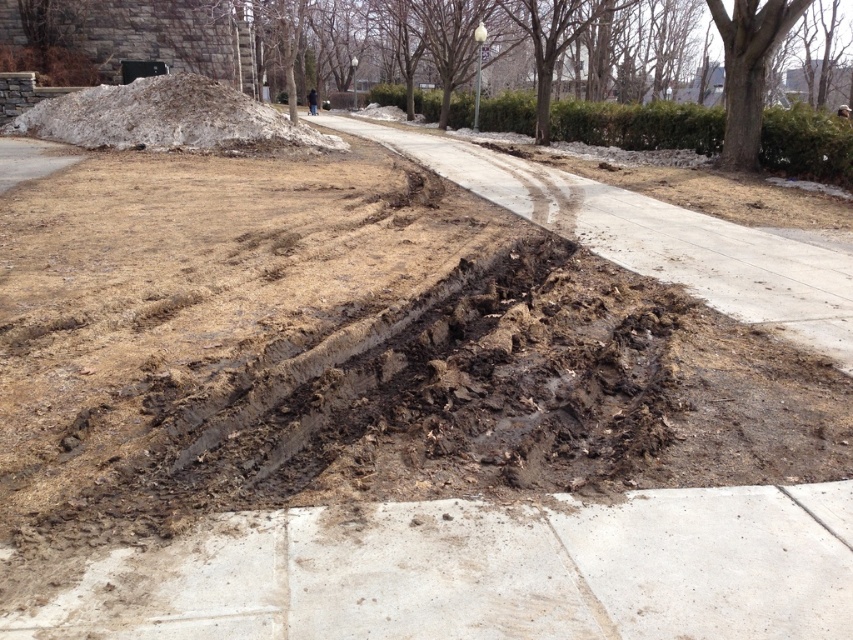
Question: Considering the relative positions of smooth concrete pavement at lower center and white snow at upper left in the image provided, where is smooth concrete pavement at lower center located with respect to white snow at upper left?

Choices:
 (A) left
 (B) right

Answer: (B)

Question: From the image, what is the correct spatial relationship of smooth concrete pavement at lower center in relation to white snow at upper left?

Choices:
 (A) below
 (B) above

Answer: (A)

Question: Which of the following is the closest to the observer?

Choices:
 (A) white snow at upper left
 (B) smooth concrete pavement at lower center

Answer: (B)

Question: Can you confirm if smooth concrete pavement at lower center is positioned to the right of white snow at upper left?

Choices:
 (A) yes
 (B) no

Answer: (A)

Question: Which point appears farthest from the camera in this image?

Choices:
 (A) (317, 147)
 (B) (639, 516)

Answer: (A)